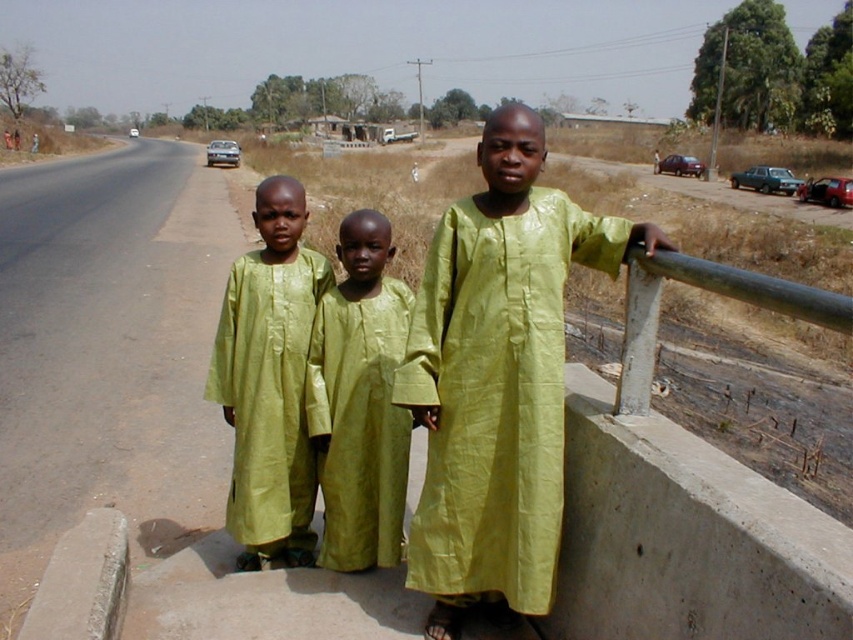
Question: Is lime green silk robe at right further to camera compared to matte green dress at center?

Choices:
 (A) yes
 (B) no

Answer: (B)

Question: Which object is farther from the camera taking this photo?

Choices:
 (A) matte green dress at center
 (B) green shiny dress at center
 (C) lime green silk robe at right

Answer: (A)

Question: Which is nearer to the matte green dress at center?

Choices:
 (A) green shiny dress at center
 (B) lime green silk robe at right

Answer: (A)

Question: Does lime green silk robe at right come behind matte green dress at center?

Choices:
 (A) no
 (B) yes

Answer: (A)

Question: Does matte green dress at center appear over green shiny dress at center?

Choices:
 (A) no
 (B) yes

Answer: (B)

Question: Which object is farther from the camera taking this photo?

Choices:
 (A) lime green silk robe at right
 (B) matte green dress at center
 (C) green shiny dress at center

Answer: (B)